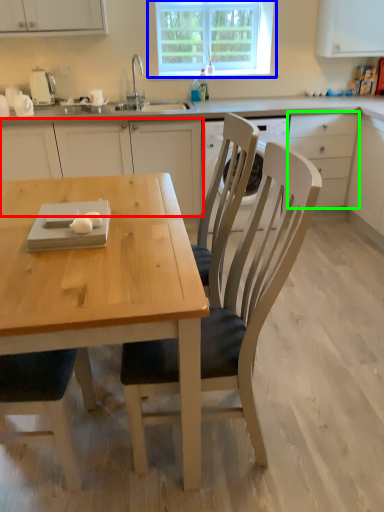
Question: Which is nearer to the cabinetry (highlighted by a red box)? window (highlighted by a blue box) or drawer (highlighted by a green box).

Choices:
 (A) window
 (B) drawer

Answer: (A)